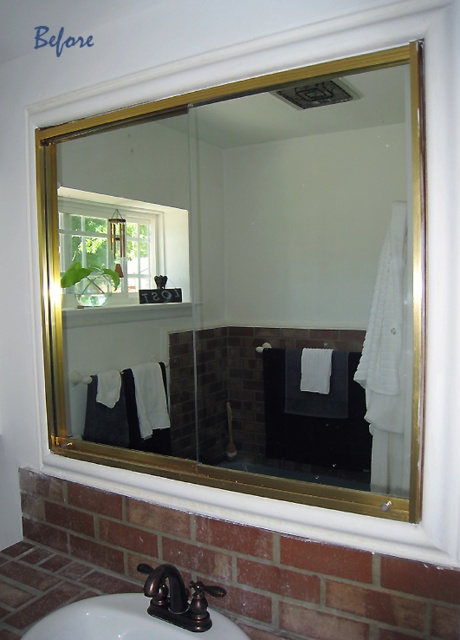
You are standing in the bathroom and want to adjust the matte black faucet at lower center. However, you notice that the gold metallic mirror at upper center is blocking your view. Is the mirror closer to you than the faucet?

Yes, the gold metallic mirror at upper center is closer to you than the matte black faucet at lower center, so it is blocking your view.

You are standing in the bathroom and want to reach the point at coordinates point (174, 628). If your arm can extend 3 feet, can you reach it without moving?

The point (174, 628) is 3.46 feet away from you, which is beyond your arm reach of 3 feet. Therefore, you cannot reach it without moving.

You are standing in the bathroom and want to hang a small white towel. Where is the white matte towel bar at center located?

The white matte towel bar at center is located at point (79, 378).